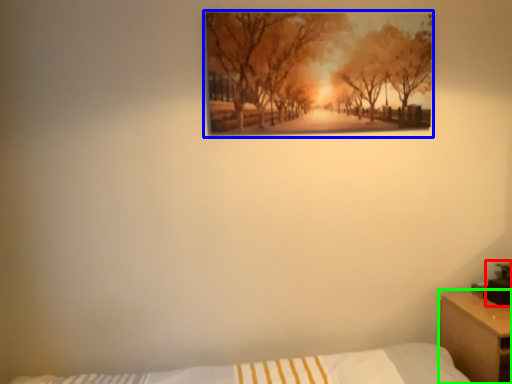
Question: Which object is positioned farthest from table lamp (highlighted by a red box)? Select from picture frame (highlighted by a blue box) and nightstand (highlighted by a green box).

Choices:
 (A) picture frame
 (B) nightstand

Answer: (A)